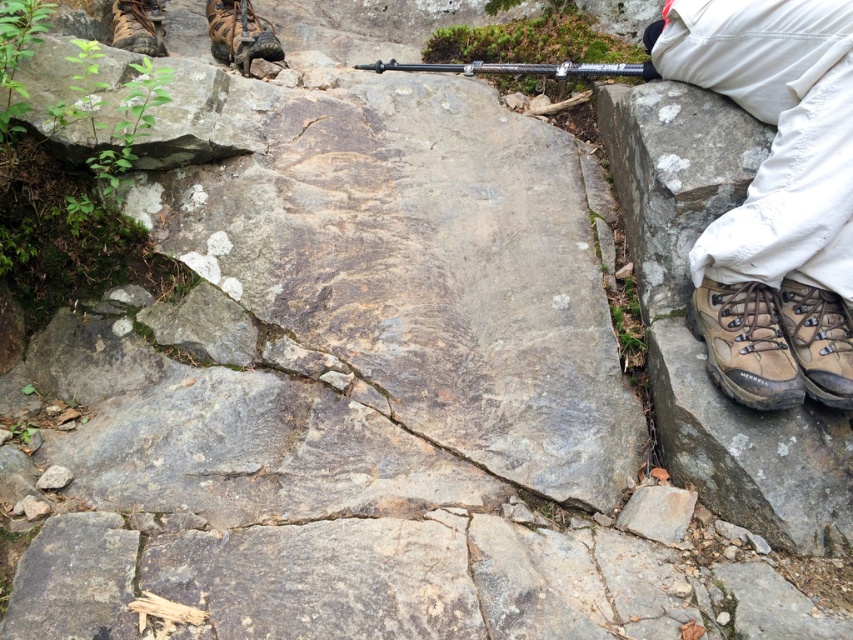
You are a hiker trying to place both brown leather boot at lower right and brown leather boot at upper left on a narrow rock path. Which boot will require more space horizontally?

The brown leather boot at upper left requires more horizontal space because its width is greater than the brown leather boot at lower right.

You are a hiker trying to place your gear on the rocky terrain. You have two items to place next to each other on the trail. One is the brown leather boots at lower right and the other is the brown leather boot at upper left. Which item requires more space horizontally?

The brown leather boot at upper left requires more horizontal space because it is thicker than the brown leather boots at lower right.

Based on the photo, you are a hiker trying to navigate the rocky terrain. You notice two pairs of brown leather boots in the scene. Which pair is closer to you, the brown leather boots at lower right or the brown leather boot at upper left?

The brown leather boots at lower right is closer to you because it is in front of the brown leather boot at upper left.